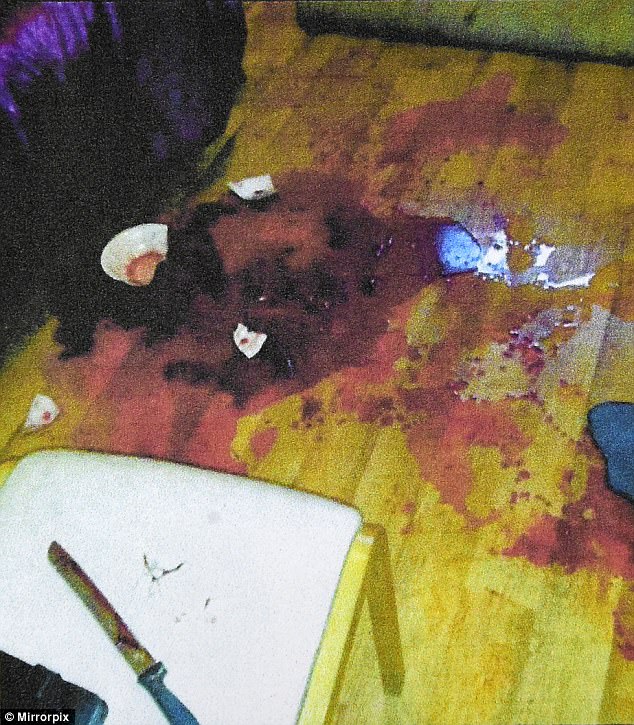
You are a GUI agent. You are given a task and a screenshot of the screen. Output one action in this format:
    pyautogui.click(x=<x>, y=<y>)
    Task: Click on the knife handle
    The image size is (634, 725).
    Given the screenshot: What is the action you would take?
    pyautogui.click(x=167, y=700)